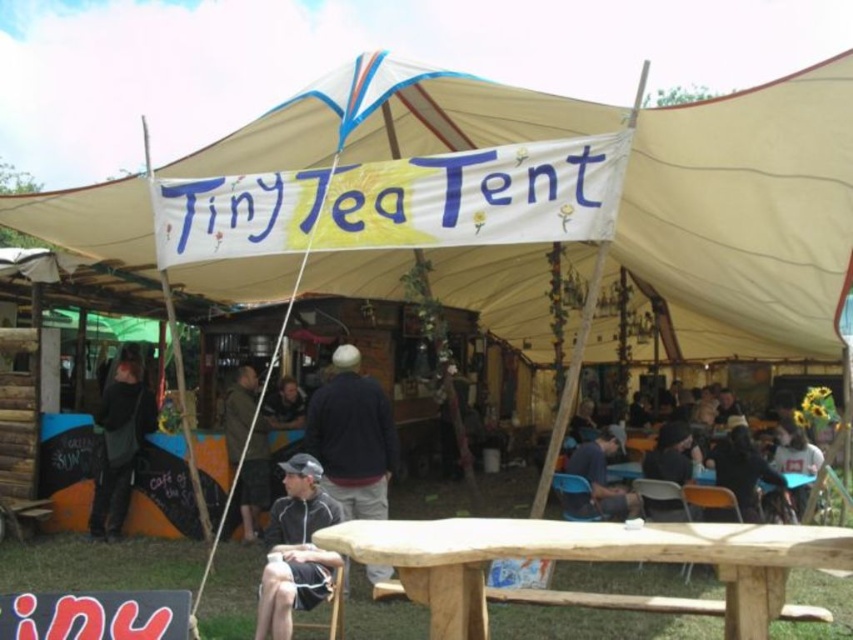
Question: Is black fabric jacket at lower center thinner than dark blue jacket at center?

Choices:
 (A) no
 (B) yes

Answer: (A)

Question: Which point is closer to the camera?

Choices:
 (A) dark blue shirt at center
 (B) black fabric jacket at lower center
 (C) dark gray hoodie at left
 (D) dark blue jacket at center

Answer: (B)

Question: Is black fabric jacket at lower center positioned behind dark blue jacket at center?

Choices:
 (A) yes
 (B) no

Answer: (B)

Question: Estimate the real-world distances between objects in this image. Which object is farther from the black fabric jacket at lower center?

Choices:
 (A) dark blue shirt at center
 (B) natural wood table at center
 (C) dark blue sweater at center

Answer: (A)

Question: Which point is farther to the camera?

Choices:
 (A) (373, 468)
 (B) (666, 524)

Answer: (A)

Question: Is beige canvas canopy at center closer to the viewer compared to natural wood table at center?

Choices:
 (A) yes
 (B) no

Answer: (B)